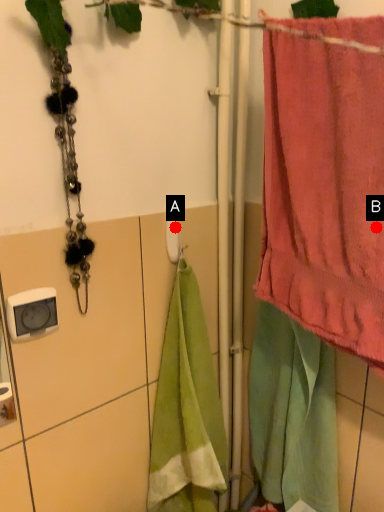
Question: Two points are circled on the image, labeled by A and B beside each circle. Which point is further to the camera?

Choices:
 (A) A is further
 (B) B is further

Answer: (A)